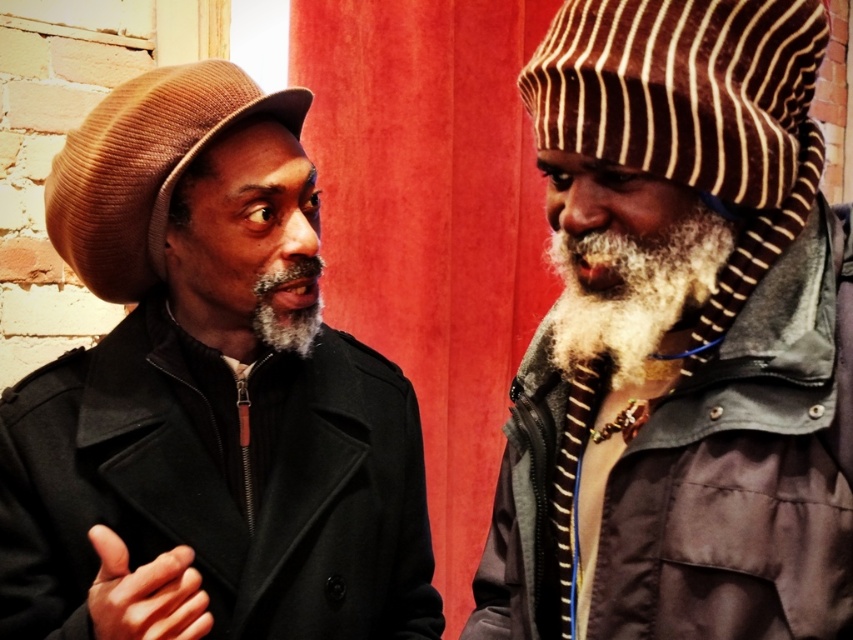
You are a photographer trying to capture a closeup of the beards in the scene. You want to focus on the white fuzzy beard at center and the gray matte beard at left. Which beard should you adjust your camera to focus on first if you want to start with the one closer to the front?

The white fuzzy beard at center is above the gray matte beard at left, so it is closer to the front. Therefore, you should focus on the white fuzzy beard at center first.

You are a fashion designer observing two hats in the scene. The matte brown hat at left and the brown corduroy hat at left. Which hat is taller?

The matte brown hat at left is taller than the brown corduroy hat at left according to the description.